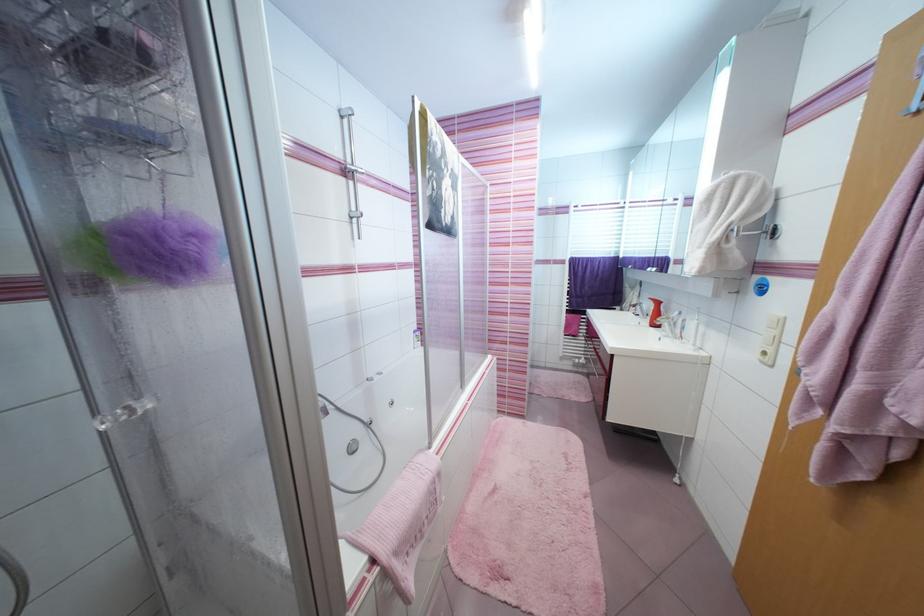
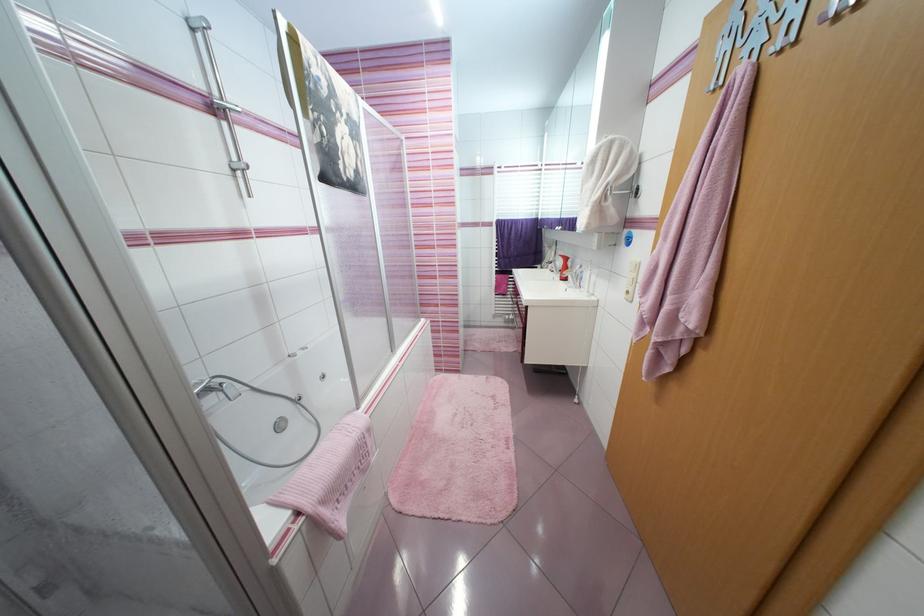
Locate, in the second image, the point that corresponds to (x=771, y=354) in the first image.

(633, 293)